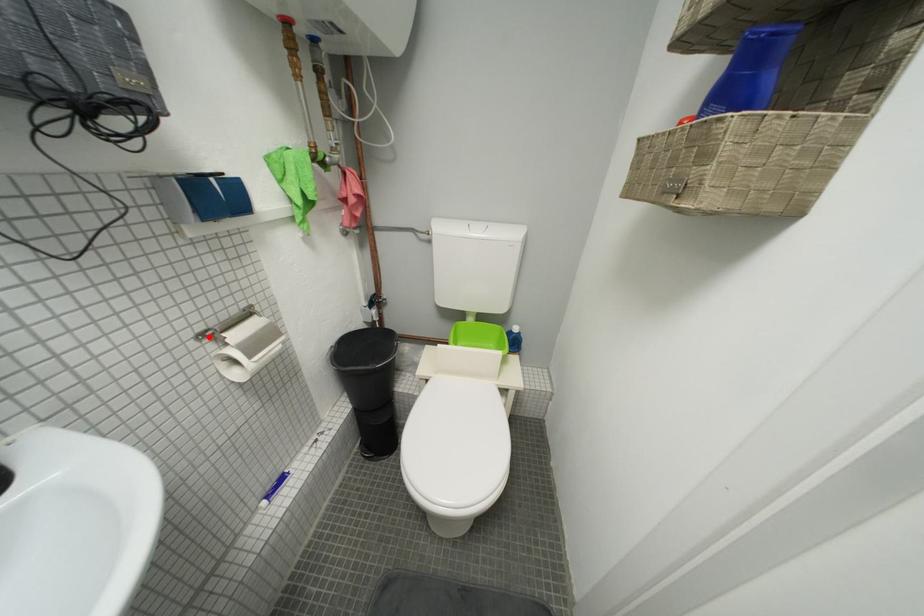
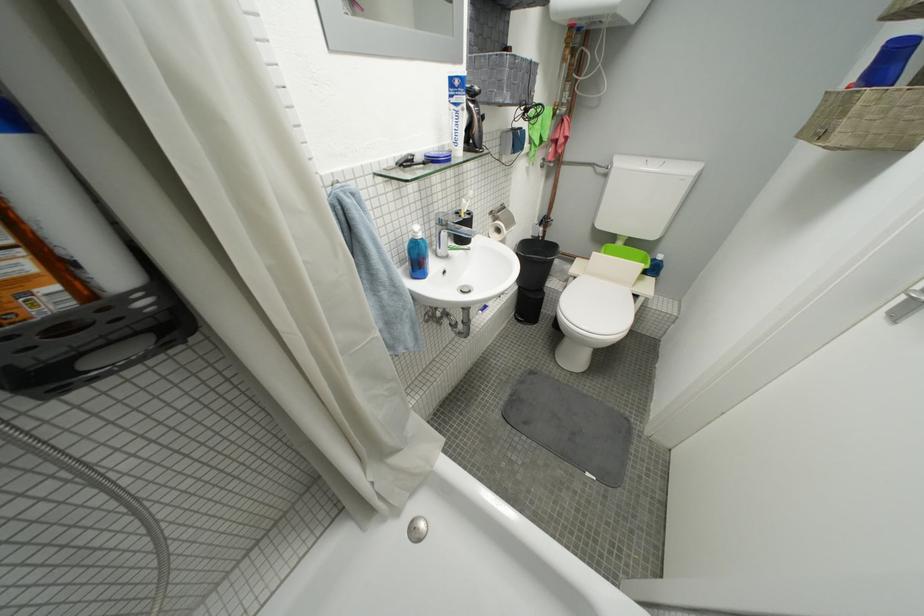
The point at the highlighted location is marked in the first image. Where is the corresponding point in the second image?

(500, 214)